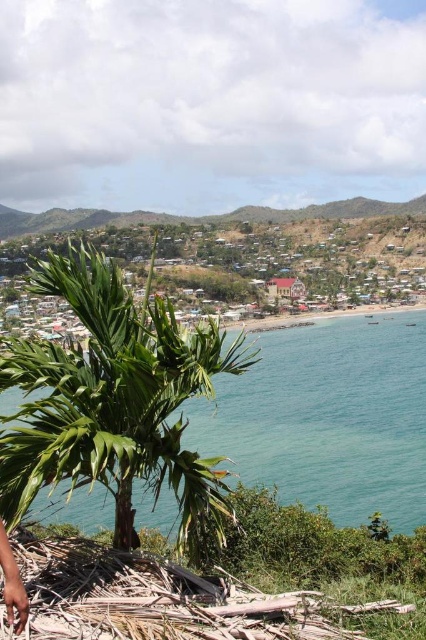
You are standing at the point marked as point (112, 400) in the image. What object is directly in front of you?

The point (112, 400) corresponds to the green leafy palm tree at center, so the object directly in front of you is the green leafy palm tree at center.

You are a drone operator trying to capture a photo of the brown textured palm fronds at lower left and the green water at center. You need to adjust your camera angle so both objects are in frame. Which object should you focus on first to ensure both are visible?

The green water at center is taller than brown textured palm fronds at lower left, so you should focus on the green water at center first to ensure both objects are visible in the frame.

You are standing at the base of the green palm tree on the left side of the frame. You want to walk directly towards the green water at center. In which direction should you head relative to the palm tree?

The green water at center is located at point [328,417], so you should head towards the center of the image from the palm tree on the left side.